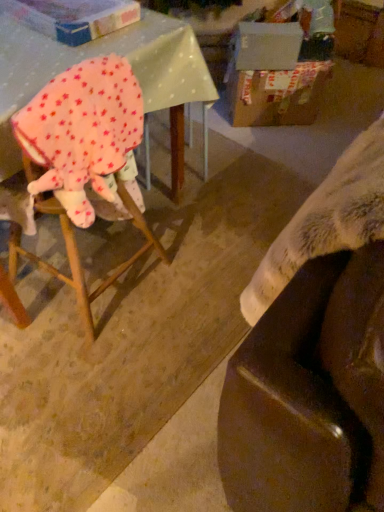
Question: Considering the relative sizes of wooden chair at left and cardboard box at upper left, the second cardboard box positioned from the right, in the image provided, is wooden chair at left wider than cardboard box at upper left, the second cardboard box positioned from the right,?

Choices:
 (A) no
 (B) yes

Answer: (B)

Question: Is wooden chair at left aimed at cardboard box at upper left, which ranks as the first cardboard box in front-to-back order?

Choices:
 (A) no
 (B) yes

Answer: (A)

Question: Considering the relative sizes of wooden chair at left and cardboard box at upper left, the first cardboard box viewed from the left, in the image provided, is wooden chair at left taller than cardboard box at upper left, the first cardboard box viewed from the left,?

Choices:
 (A) no
 (B) yes

Answer: (B)

Question: Would you say wooden chair at left is outside cardboard box at upper left, the first cardboard box viewed from the left?

Choices:
 (A) yes
 (B) no

Answer: (A)

Question: Can you confirm if wooden chair at left is shorter than cardboard box at upper left, the second cardboard box when ordered from back to front?

Choices:
 (A) no
 (B) yes

Answer: (A)

Question: Does wooden chair at left contain cardboard box at upper left, the second cardboard box positioned from the right?

Choices:
 (A) no
 (B) yes

Answer: (A)

Question: Does cardboard box at upper left, which ranks as the first cardboard box in front-to-back order, turn towards wooden chair at left?

Choices:
 (A) yes
 (B) no

Answer: (B)

Question: Does cardboard box at upper left, the second cardboard box when ordered from back to front, come in front of wooden chair at left?

Choices:
 (A) yes
 (B) no

Answer: (B)

Question: Can you confirm if cardboard box at upper left, the first cardboard box viewed from the left, is bigger than wooden chair at left?

Choices:
 (A) no
 (B) yes

Answer: (A)

Question: Considering the relative sizes of cardboard box at upper left, the first cardboard box viewed from the left, and wooden chair at left in the image provided, is cardboard box at upper left, the first cardboard box viewed from the left, thinner than wooden chair at left?

Choices:
 (A) no
 (B) yes

Answer: (B)

Question: Can you confirm if cardboard box at upper left, the second cardboard box positioned from the right, is shorter than wooden chair at left?

Choices:
 (A) yes
 (B) no

Answer: (A)

Question: Considering the relative positions of cardboard box at upper left, which ranks as the first cardboard box in front-to-back order, and wooden chair at left in the image provided, is cardboard box at upper left, which ranks as the first cardboard box in front-to-back order, to the right of wooden chair at left from the viewer's perspective?

Choices:
 (A) yes
 (B) no

Answer: (B)

Question: Is wooden chair at left closer to camera compared to fluffy white blanket at lower right?

Choices:
 (A) yes
 (B) no

Answer: (B)